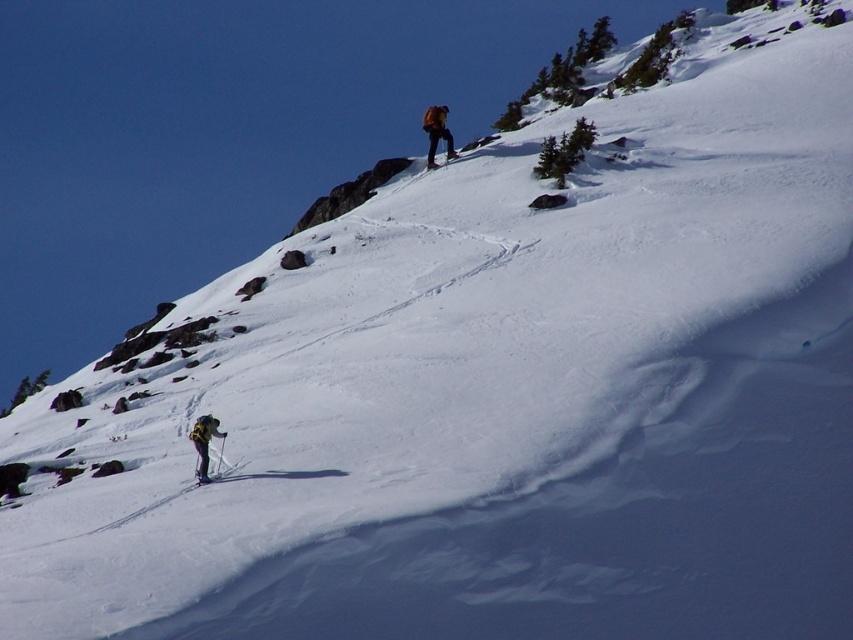
Question: Which point is farther from the camera taking this photo?

Choices:
 (A) (196, 419)
 (B) (219, 460)

Answer: (A)

Question: Which of the following is the farthest from the observer?

Choices:
 (A) shiny metallic ski at lower left
 (B) yellow fabric backpack at lower left

Answer: (B)

Question: Can you confirm if orange fabric jacket at upper center is smaller than black plastic ski pole at lower left?

Choices:
 (A) no
 (B) yes

Answer: (A)

Question: Considering the real-world distances, which object is farthest from the orange fabric jacket at upper center?

Choices:
 (A) black plastic ski pole at lower left
 (B) yellow fabric backpack at lower left
 (C) shiny metallic ski at lower left

Answer: (A)

Question: Is orange fabric jacket at upper center further to camera compared to shiny metallic ski at lower left?

Choices:
 (A) no
 (B) yes

Answer: (B)

Question: Considering the relative positions of orange fabric jacket at upper center and shiny metallic ski at lower left in the image provided, where is orange fabric jacket at upper center located with respect to shiny metallic ski at lower left?

Choices:
 (A) below
 (B) above

Answer: (B)